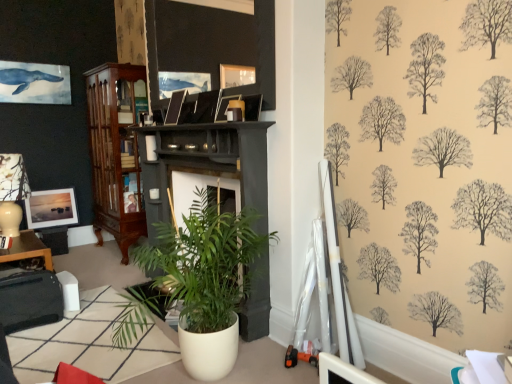
Question: Does matte black lampshade at left lie behind white glossy table at lower left, the 1th table from the back?

Choices:
 (A) no
 (B) yes

Answer: (A)

Question: From the image's perspective, is matte black lampshade at left above white glossy table at lower left, arranged as the first table when viewed from the top?

Choices:
 (A) yes
 (B) no

Answer: (A)

Question: Is matte black lampshade at left bigger than white glossy table at lower left, the 1th table from the back?

Choices:
 (A) no
 (B) yes

Answer: (B)

Question: Is matte black lampshade at left thinner than white glossy table at lower left, which is counted as the first table, starting from the left?

Choices:
 (A) no
 (B) yes

Answer: (A)

Question: Could you tell me if matte black lampshade at left is turned towards white glossy table at lower left, arranged as the 2th table when viewed from the right?

Choices:
 (A) no
 (B) yes

Answer: (A)

Question: From the image's perspective, is wooden picture frame at upper center, the first picture frame in the top-to-bottom sequence, located above or below matte black lampshade at left?

Choices:
 (A) below
 (B) above

Answer: (B)

Question: Visually, is wooden picture frame at upper center, the second picture frame from the left, positioned to the left or to the right of matte black lampshade at left?

Choices:
 (A) right
 (B) left

Answer: (A)

Question: Relative to matte black lampshade at left, is wooden picture frame at upper center, arranged as the third picture frame when viewed from the back, in front or behind?

Choices:
 (A) behind
 (B) front

Answer: (B)

Question: From a real-world perspective, is wooden picture frame at upper center, which appears as the third picture frame when ordered from the bottom, physically located above or below matte black lampshade at left?

Choices:
 (A) below
 (B) above

Answer: (B)

Question: Is white glossy table at lower left, which ranks as the second table in top-to-bottom order, situated inside wooden picture frame at upper center, arranged as the third picture frame when viewed from the back, or outside?

Choices:
 (A) outside
 (B) inside

Answer: (A)

Question: Looking at the image, does white glossy table at lower left, acting as the 1th table starting from the front, seem bigger or smaller compared to wooden picture frame at upper center, the second picture frame when ordered from right to left?

Choices:
 (A) small
 (B) big

Answer: (A)

Question: Considering the positions of point (168, 327) and point (160, 59), is point (168, 327) closer or farther from the camera than point (160, 59)?

Choices:
 (A) closer
 (B) farther

Answer: (A)

Question: From a real-world perspective, is white glossy table at lower left, which ranks as the second table in top-to-bottom order, positioned above or below wooden picture frame at upper center, the first picture frame in the top-to-bottom sequence?

Choices:
 (A) below
 (B) above

Answer: (A)

Question: From the image's perspective, is wooden picture frame at upper center, which appears as the first picture frame when viewed from the front, positioned above or below mahogany wood cabinet at left?

Choices:
 (A) above
 (B) below

Answer: (A)

Question: Considering their positions, is wooden picture frame at upper center, the second picture frame from the left, located in front of or behind mahogany wood cabinet at left?

Choices:
 (A) front
 (B) behind

Answer: (A)